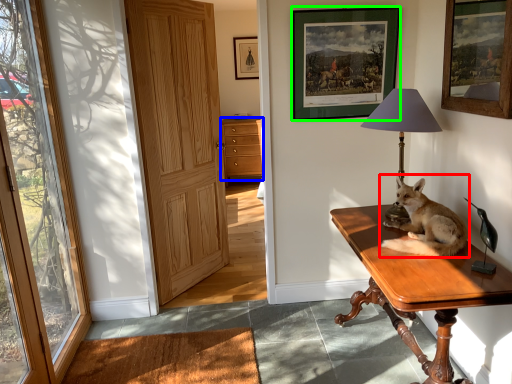
Question: Considering the real-world distances, which object is farthest from dog (highlighted by a red box)? cabinetry (highlighted by a blue box) or picture frame (highlighted by a green box)?

Choices:
 (A) cabinetry
 (B) picture frame

Answer: (A)